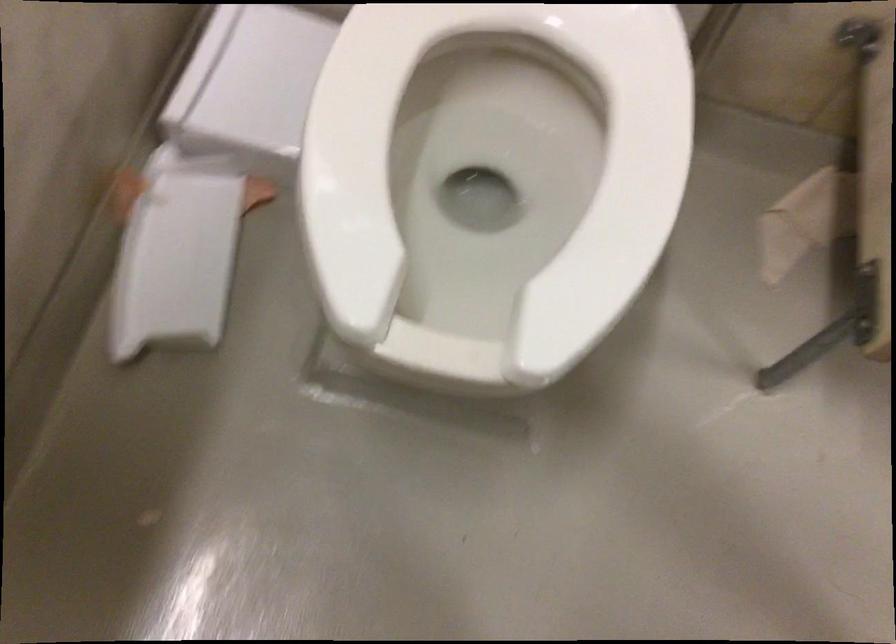
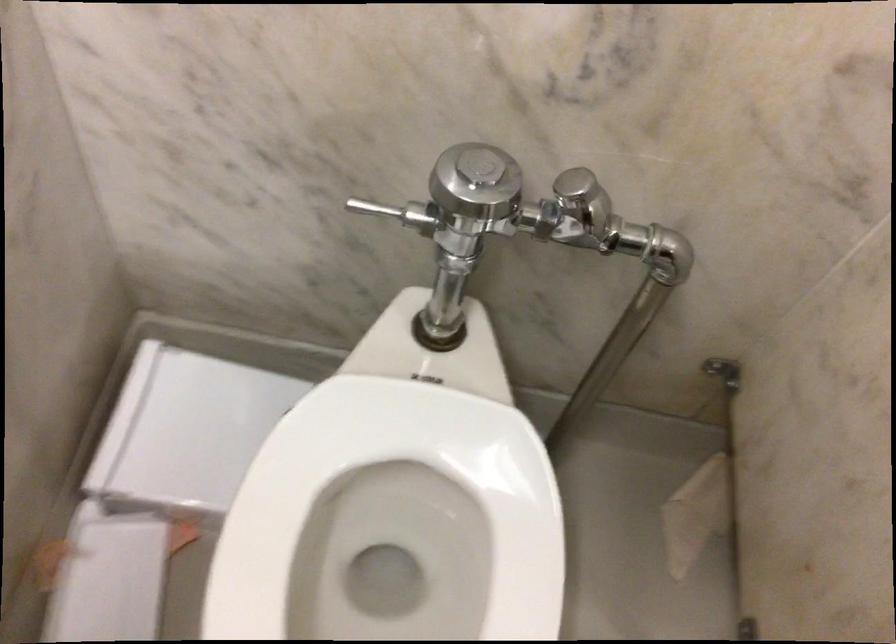
In a continuous first-person perspective shot, in which direction is the camera moving?

The cameraman walked toward right, backward.